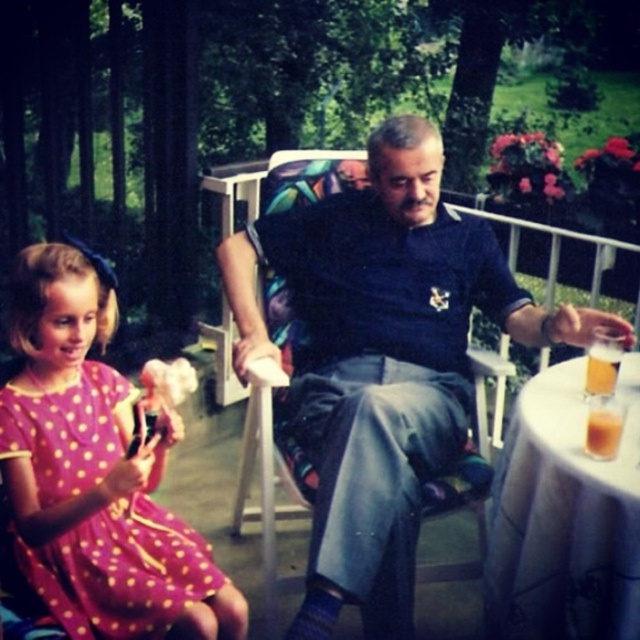
Question: Estimate the real-world distances between objects in this image. Which object is farther from the translucent glass beer at table right?

Choices:
 (A) translucent glass beverage at table right
 (B) pink polka dot fabric dress at lower left
 (C) multicolored fabric chair at center

Answer: (B)

Question: Which point is closer to the camera?

Choices:
 (A) (492, 273)
 (B) (602, 378)

Answer: (B)

Question: Which object is farther from the camera taking this photo?

Choices:
 (A) white cloth-covered table at lower right
 (B) pink polka dot fabric dress at lower left
 (C) translucent glass beer at table right

Answer: (C)

Question: Can you confirm if white cloth-covered table at lower right is positioned above translucent glass beer at table right?

Choices:
 (A) yes
 (B) no

Answer: (B)

Question: Can you confirm if white cloth-covered table at lower right is positioned above pink polka dot fabric dress at lower left?

Choices:
 (A) no
 (B) yes

Answer: (B)

Question: Is pink polka dot fabric dress at lower left bigger than translucent glass beverage at table right?

Choices:
 (A) yes
 (B) no

Answer: (A)